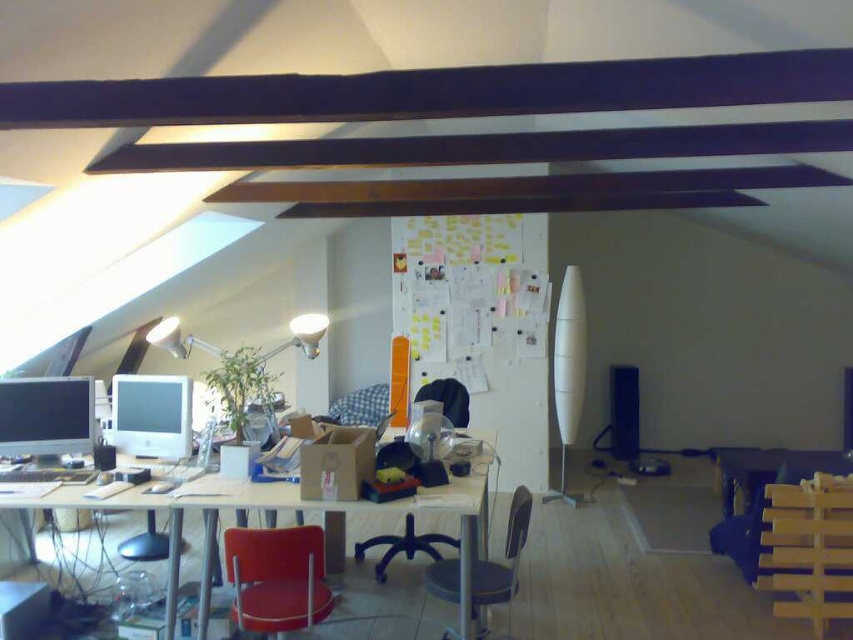
You are sitting in the black swivel chair at the desk and want to reach the metallic gray chair at center. Is it possible to move directly to it without moving around the white glossy computer monitor at center?

The metallic gray chair at center is behind the white glossy computer monitor at center, so you would need to move around the white glossy computer monitor at center to reach it directly.

You are organizing your workspace and want to move the metallic gray chair at center closer to the skylight on the left. Which direction should you move it relative to the white glossy computer monitor at center?

You should move the metallic gray chair at center to the left of the white glossy computer monitor at center since the monitor is already to the right of the chair, and moving it left would bring it closer to the skylight on the left.